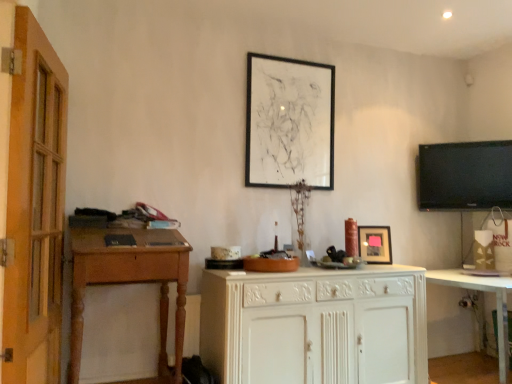
In order to click on black glossy tv at upper right in this screenshot , I will do `click(465, 175)`.

Describe the element at coordinates (375, 244) in the screenshot. The height and width of the screenshot is (384, 512). I see `matte black picture frame at center, the 2th picture frame positioned from the left` at that location.

What do you see at coordinates (289, 122) in the screenshot?
I see `black matte picture frame at upper center, the 2th picture frame in the right-to-left sequence` at bounding box center [289, 122].

Where is `black matte picture frame at upper center, the first picture frame when ordered from left to right`? The height and width of the screenshot is (384, 512). black matte picture frame at upper center, the first picture frame when ordered from left to right is located at coordinates (289, 122).

You are a GUI agent. You are given a task and a screenshot of the screen. Output one action in this format:
    pyautogui.click(x=<x>, y=<y>)
    Task: Click on the wooden desk at left
    
    Given the screenshot: What is the action you would take?
    pyautogui.click(x=130, y=283)

Who is smaller, black glossy tv at upper right or black matte picture frame at upper center, which is the 2th picture frame from bottom to top?

Smaller between the two is black glossy tv at upper right.

Looking at this image, considering the relative positions of black glossy tv at upper right and black matte picture frame at upper center, which is the 2th picture frame from bottom to top, in the image provided, is black glossy tv at upper right behind black matte picture frame at upper center, which is the 2th picture frame from bottom to top,?

Yes.

Is black glossy tv at upper right wider or thinner than black matte picture frame at upper center, the first picture frame when ordered from left to right?

black glossy tv at upper right is wider than black matte picture frame at upper center, the first picture frame when ordered from left to right.

Which is nearer, [424,159] or [264,150]?

Point [424,159].

How different are the orientations of matte black picture frame at center, acting as the second picture frame starting from the top, and white glossy cabinet at lower right in degrees?

They differ by 52.5 degrees in their facing directions.

Is matte black picture frame at center, acting as the second picture frame starting from the top, at the right side of white glossy cabinet at lower right?

In fact, matte black picture frame at center, acting as the second picture frame starting from the top, is to the left of white glossy cabinet at lower right.

Which object is further away from the camera, matte black picture frame at center, acting as the second picture frame starting from the top, or white glossy cabinet at lower right?

matte black picture frame at center, acting as the second picture frame starting from the top, is further from the camera.

From a real-world perspective, which object stands above the other?

matte black picture frame at center, which is counted as the first picture frame, starting from the bottom.

Looking at their sizes, would you say wooden desk at left is wider or thinner than black matte picture frame at upper center, which is the 2th picture frame from bottom to top?

In the image, wooden desk at left appears to be wider than black matte picture frame at upper center, which is the 2th picture frame from bottom to top.

Based on their positions, is wooden desk at left located to the left or right of black matte picture frame at upper center, placed as the first picture frame when sorted from top to bottom?

In the image, wooden desk at left appears on the left side of black matte picture frame at upper center, placed as the first picture frame when sorted from top to bottom.

Looking at this image, is wooden desk at left placed right next to black matte picture frame at upper center, the 2th picture frame in the right-to-left sequence?

No, wooden desk at left is not touching black matte picture frame at upper center, the 2th picture frame in the right-to-left sequence.

Consider the image. Measure the distance from wooden desk at left to black matte picture frame at upper center, which is the 2th picture frame from bottom to top.

A distance of 3.95 feet exists between wooden desk at left and black matte picture frame at upper center, which is the 2th picture frame from bottom to top.

Which object is further away from the camera, black matte picture frame at upper center, placed as the first picture frame when sorted from top to bottom, or black glossy tv at upper right?

black glossy tv at upper right is more distant.

Find the location of a particular element. the 1st picture frame in front of the black glossy tv at upper right, counting from the anchor's position is located at coordinates (289, 122).

Is black matte picture frame at upper center, the 2th picture frame in the right-to-left sequence, inside the boundaries of black glossy tv at upper right, or outside?

black matte picture frame at upper center, the 2th picture frame in the right-to-left sequence, is not enclosed by black glossy tv at upper right.

Is black matte picture frame at upper center, placed as the first picture frame when sorted from top to bottom, far from black glossy tv at upper right?

Yes, black matte picture frame at upper center, placed as the first picture frame when sorted from top to bottom, is far from black glossy tv at upper right.

From a real-world perspective, is black glossy tv at upper right below white glossy cabinet at lower right?

No, from a real-world perspective, black glossy tv at upper right is not beneath white glossy cabinet at lower right.

Is black glossy tv at upper right oriented towards white glossy cabinet at lower right?

No, black glossy tv at upper right does not turn towards white glossy cabinet at lower right.

In terms of size, does black glossy tv at upper right appear bigger or smaller than white glossy cabinet at lower right?

In the image, black glossy tv at upper right appears to be smaller than white glossy cabinet at lower right.

From a real-world perspective, which is physically above, wooden desk at left or matte black picture frame at center, the 2th picture frame positioned from the left?

From a 3D spatial view, matte black picture frame at center, the 2th picture frame positioned from the left, is above.

You are a GUI agent. You are given a task and a screenshot of the screen. Output one action in this format:
    pyautogui.click(x=<x>, y=<y>)
    Task: Click on the desk in front of the matte black picture frame at center, which is counted as the first picture frame, starting from the bottom
    The height and width of the screenshot is (384, 512).
    Given the screenshot: What is the action you would take?
    pyautogui.click(x=130, y=283)

Would you say wooden desk at left is a long distance from matte black picture frame at center, which is counted as the first picture frame, starting from the bottom?

Indeed, wooden desk at left is not near matte black picture frame at center, which is counted as the first picture frame, starting from the bottom.

Which object is wider, wooden desk at left or matte black picture frame at center, the 1th picture frame from the right?

wooden desk at left.

In terms of width, does black glossy tv at upper right look wider or thinner when compared to matte black picture frame at center, which is counted as the first picture frame, starting from the bottom?

In the image, black glossy tv at upper right appears to be more narrow than matte black picture frame at center, which is counted as the first picture frame, starting from the bottom.

Could you measure the distance between black glossy tv at upper right and matte black picture frame at center, which is counted as the first picture frame, starting from the bottom?

30.23 inches.

How many degrees apart are the facing directions of black glossy tv at upper right and matte black picture frame at center, the 1th picture frame from the right?

The facing directions of black glossy tv at upper right and matte black picture frame at center, the 1th picture frame from the right, are 3.04 degrees apart.

In terms of height, does black glossy tv at upper right look taller or shorter compared to matte black picture frame at center, the 1th picture frame from the right?

black glossy tv at upper right is taller than matte black picture frame at center, the 1th picture frame from the right.

Which picture frame is the 1st one when counting from the front of the black glossy tv at upper right? Please provide its 2D coordinates.

[(289, 122)]

From a real-world perspective, starting from the white glossy cabinet at lower right, which picture frame is the 1st one vertically above it? Please provide its 2D coordinates.

[(375, 244)]

Which object lies further to the anchor point matte black picture frame at center, which is counted as the first picture frame, starting from the bottom, wooden desk at left or black glossy tv at upper right?

Based on the image, wooden desk at left appears to be further to matte black picture frame at center, which is counted as the first picture frame, starting from the bottom.

Considering their positions, is black matte picture frame at upper center, which is the 2th picture frame from bottom to top, positioned further to white glossy cabinet at lower right than black glossy tv at upper right?

black matte picture frame at upper center, which is the 2th picture frame from bottom to top, lies further to white glossy cabinet at lower right than the other object.

Estimate the real-world distances between objects in this image. Which object is closer to white glossy cabinet at lower right, wooden desk at left or matte black picture frame at center, which is counted as the first picture frame, starting from the bottom?

Among the two, matte black picture frame at center, which is counted as the first picture frame, starting from the bottom, is located nearer to white glossy cabinet at lower right.

When comparing their distances from black glossy tv at upper right, does matte black picture frame at center, the 1th picture frame from the right, or white glossy cabinet at lower right seem further?

white glossy cabinet at lower right is further to black glossy tv at upper right.

Which object lies nearer to the anchor point matte black picture frame at center, the 2th picture frame positioned from the left, white glossy cabinet at lower right or black glossy tv at upper right?

white glossy cabinet at lower right is positioned closer to the anchor matte black picture frame at center, the 2th picture frame positioned from the left.

Based on their spatial positions, is black matte picture frame at upper center, the first picture frame when ordered from left to right, or white painted wood cabinet at center closer to white glossy cabinet at lower right?

white painted wood cabinet at center.

When comparing their distances from wooden desk at left, does white glossy cabinet at lower right or white painted wood cabinet at center seem closer?

white painted wood cabinet at center is closer to wooden desk at left.

Based on their spatial positions, is wooden desk at left or white painted wood cabinet at center closer to black glossy tv at upper right?

white painted wood cabinet at center lies closer to black glossy tv at upper right than the other object.

The height and width of the screenshot is (384, 512). Identify the location of television located between white painted wood cabinet at center and white glossy cabinet at lower right in the left-right direction. (465, 175).

The width and height of the screenshot is (512, 384). Find the location of `television situated between wooden desk at left and white glossy cabinet at lower right from left to right`. television situated between wooden desk at left and white glossy cabinet at lower right from left to right is located at coordinates (465, 175).

Where is `picture frame between black matte picture frame at upper center, placed as the first picture frame when sorted from top to bottom, and white painted wood cabinet at center vertically`? The height and width of the screenshot is (384, 512). picture frame between black matte picture frame at upper center, placed as the first picture frame when sorted from top to bottom, and white painted wood cabinet at center vertically is located at coordinates (375, 244).

At what (x,y) coordinates should I click in order to perform the action: click on cabinetry between wooden desk at left and white glossy cabinet at lower right in the horizontal direction. Please return your answer as a coordinate pair (x, y). The image size is (512, 384). Looking at the image, I should click on (316, 325).